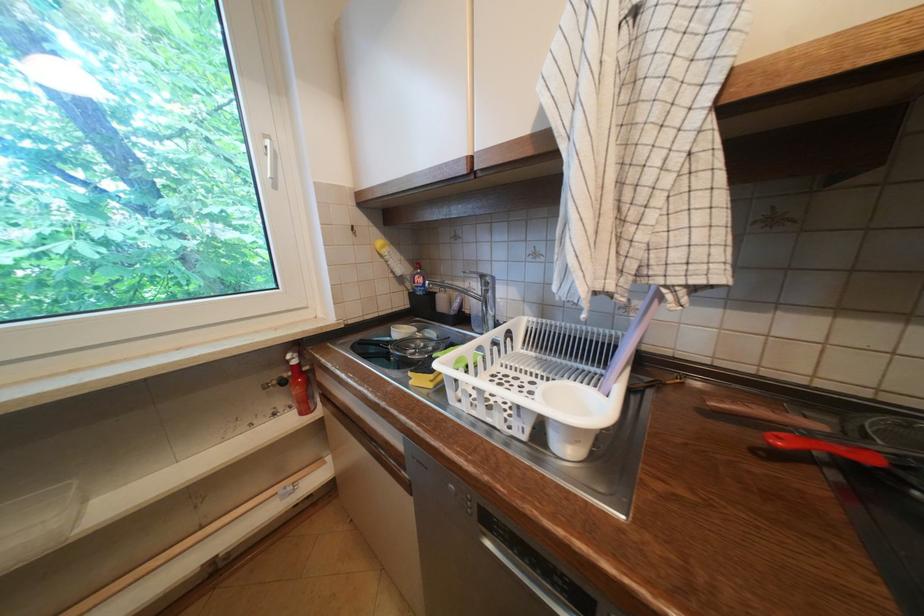
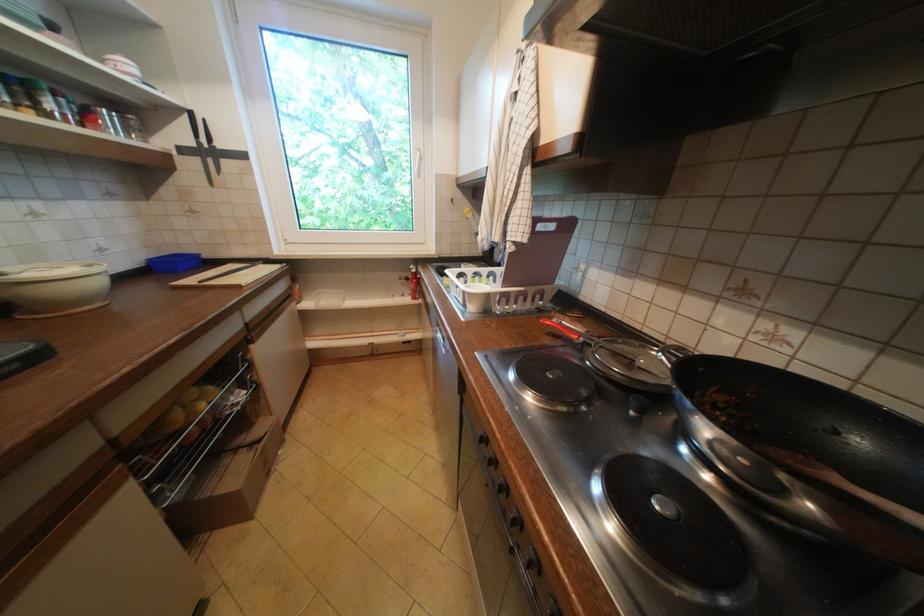
Find the pixel in the second image that matches pixel 283 416 in the first image.

(410, 296)